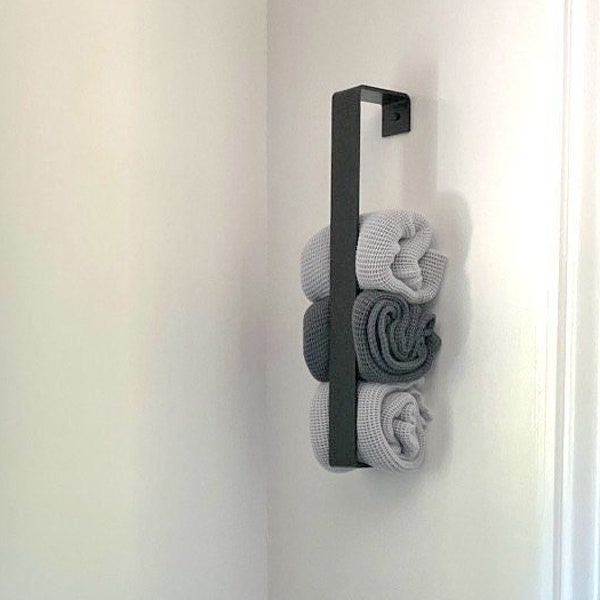
The width and height of the screenshot is (600, 600). I want to click on white wall, so click(x=71, y=227), click(x=374, y=44).